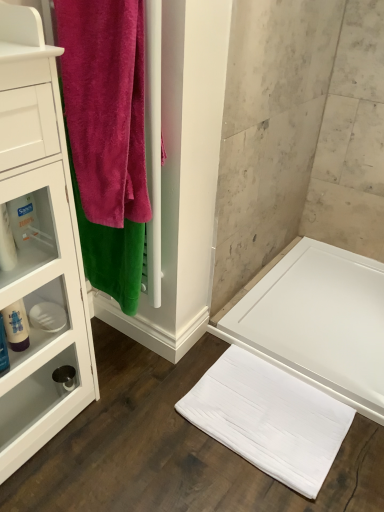
Question: From the image's perspective, is translucent plastic bottle at left over translucent plastic bottle at left, the 2th toiletry from the back?

Choices:
 (A) yes
 (B) no

Answer: (A)

Question: Can you confirm if translucent plastic bottle at left is thinner than translucent plastic bottle at left, the 2th toiletry from the back?

Choices:
 (A) no
 (B) yes

Answer: (A)

Question: From the image's perspective, would you say translucent plastic bottle at left is shown under translucent plastic bottle at left, positioned as the second toiletry in front-to-back order?

Choices:
 (A) yes
 (B) no

Answer: (B)

Question: Are translucent plastic bottle at left and translucent plastic bottle at left, the 2th toiletry positioned from the top, beside each other?

Choices:
 (A) no
 (B) yes

Answer: (B)

Question: Is the depth of translucent plastic bottle at left less than that of translucent plastic bottle at left, positioned as the second toiletry in front-to-back order?

Choices:
 (A) no
 (B) yes

Answer: (A)

Question: Is point [74, 380] closer or farther from the camera than point [24, 312]?

Choices:
 (A) farther
 (B) closer

Answer: (A)

Question: Is matte black faucet at lower left, the 3th toiletry from the top, taller or shorter than translucent plastic bottle at left?

Choices:
 (A) tall
 (B) short

Answer: (B)

Question: Is matte black faucet at lower left, the 3th toiletry from the top, wider or thinner than translucent plastic bottle at left?

Choices:
 (A) wide
 (B) thin

Answer: (A)

Question: From the image's perspective, relative to translucent plastic bottle at left, is matte black faucet at lower left, which ranks as the first toiletry in back-to-front order, above or below?

Choices:
 (A) above
 (B) below

Answer: (B)

Question: Considering their positions, is matte black faucet at lower left, placed as the 3th toiletry when sorted from front to back, located in front of or behind white soft towel at lower center?

Choices:
 (A) behind
 (B) front

Answer: (A)

Question: Is point (74, 373) positioned closer to the camera than point (213, 394)?

Choices:
 (A) farther
 (B) closer

Answer: (B)

Question: In terms of height, does matte black faucet at lower left, which ranks as the first toiletry in back-to-front order, look taller or shorter compared to white soft towel at lower center?

Choices:
 (A) short
 (B) tall

Answer: (B)

Question: In terms of width, does matte black faucet at lower left, the 1th toiletry ordered from the bottom, look wider or thinner when compared to white soft towel at lower center?

Choices:
 (A) thin
 (B) wide

Answer: (A)

Question: Considering the relative positions of translucent plastic bottle at left, the 2th toiletry from the back, and matte black faucet at lower left, the 3th toiletry from the top, in the image provided, is translucent plastic bottle at left, the 2th toiletry from the back, to the left or to the right of matte black faucet at lower left, the 3th toiletry from the top,?

Choices:
 (A) right
 (B) left

Answer: (B)

Question: Based on their sizes in the image, would you say translucent plastic bottle at left, the 2th toiletry from the back, is bigger or smaller than matte black faucet at lower left, the 1th toiletry ordered from the bottom?

Choices:
 (A) big
 (B) small

Answer: (A)